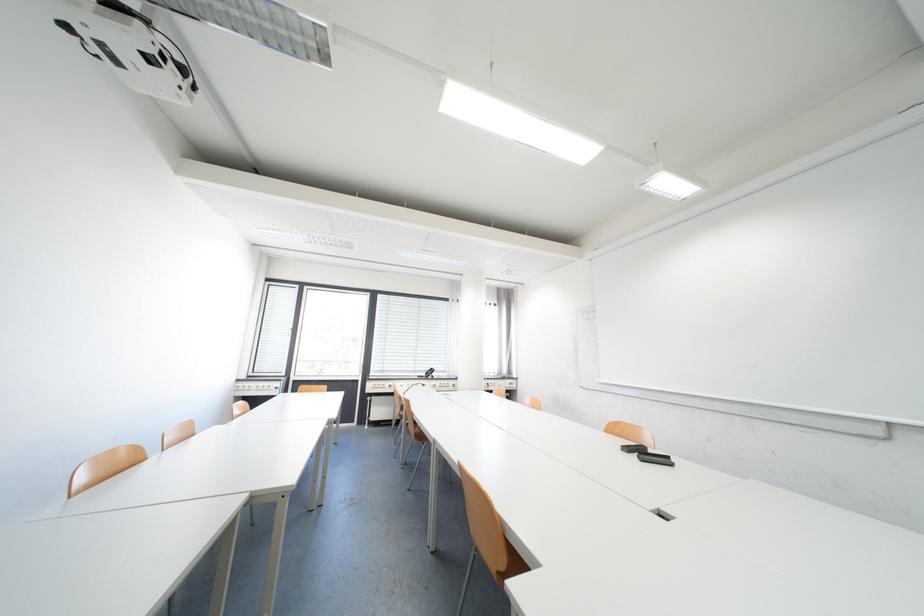
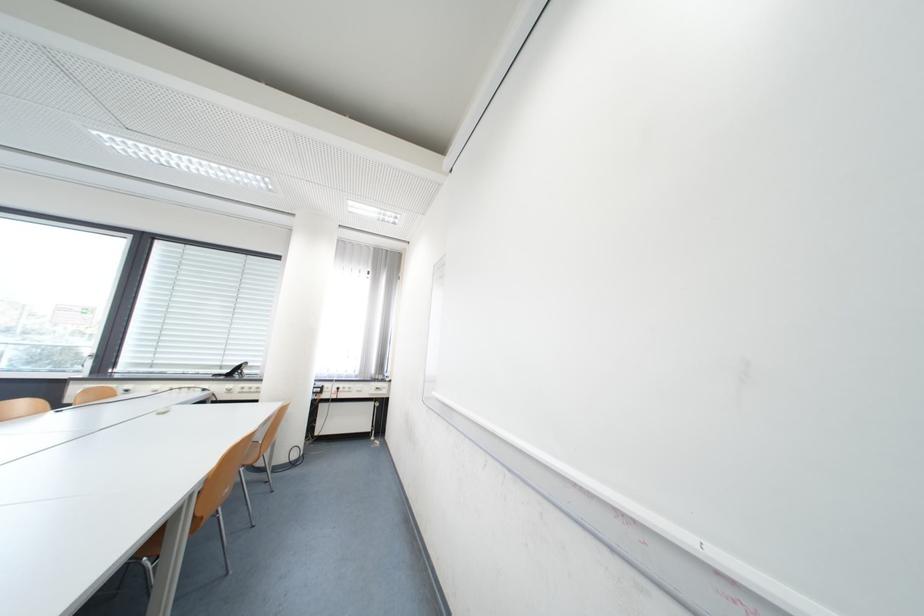
From the picture: The images are taken continuously from a first-person perspective. In which direction are you moving?

The movement direction of the cameraman is right, forward.